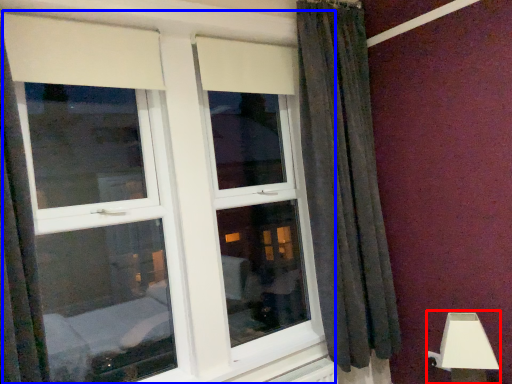
Question: Among these objects, which one is nearest to the camera, table lamp (highlighted by a red box) or window (highlighted by a blue box)?

Choices:
 (A) table lamp
 (B) window

Answer: (B)